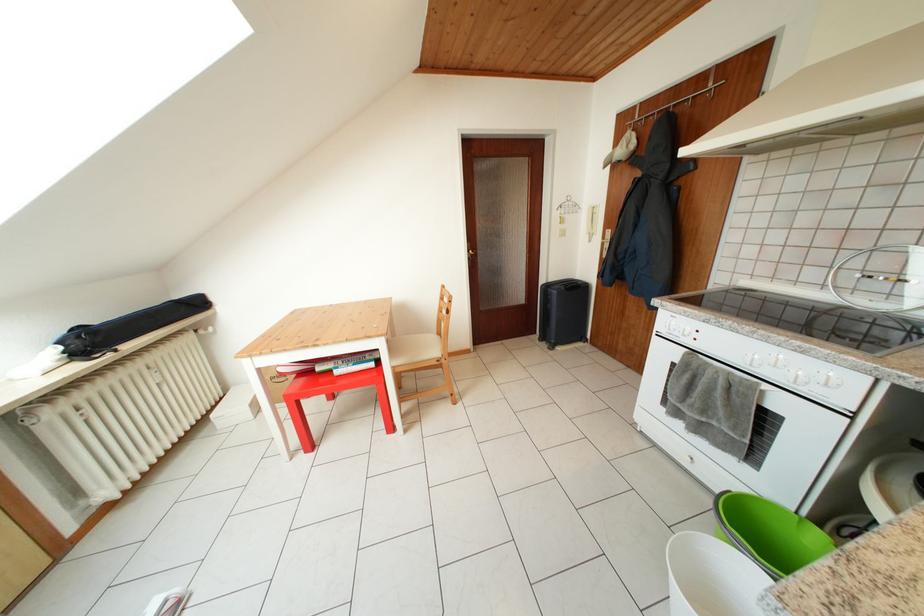
Where is `pot lid handle`? The height and width of the screenshot is (616, 924). pot lid handle is located at coordinates (769, 533).